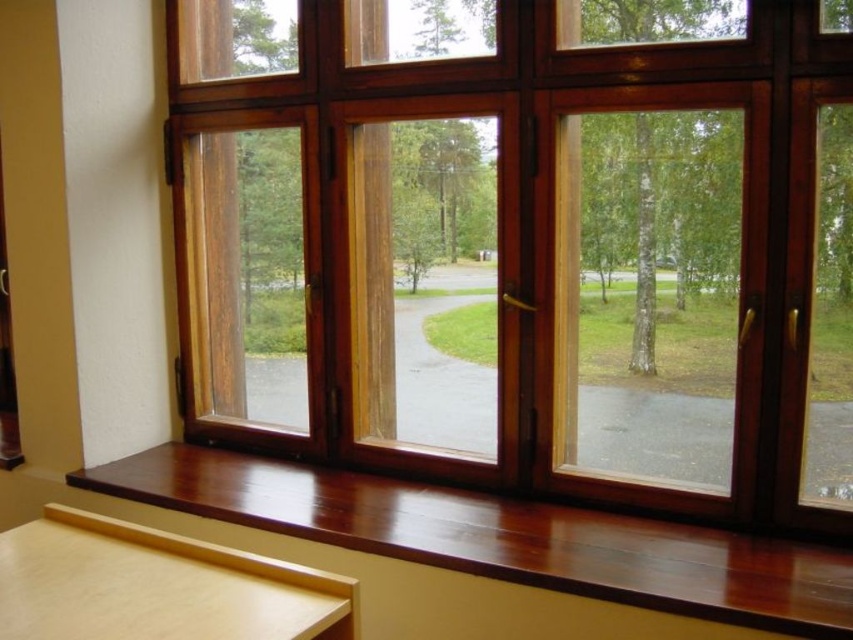
You are standing in the room and want to look out through the wooden bay window at center. Where should you position yourself to see the entire window view?

You should position yourself at point [529,246] to see the entire view of the wooden bay window at center.

You are looking through the window and see the mahogany wood window sill at lower center and the green matte tree at center. Which object is nearer to your eyes?

The mahogany wood window sill at lower center is closer to the viewer than the green matte tree at center, so the mahogany wood window sill at lower center is nearer to your eyes.

You are standing at the camera position looking at the window. There is a point marked at coordinates [525,515] on the window pane. If you want to touch this point with a 2.5 meter long pole, will the pole be long enough?

The distance between the point [525,515] and the camera is 2.01 meters. Since the pole is 2.5 meters long, which is longer than the distance, the pole will be long enough to reach the point.